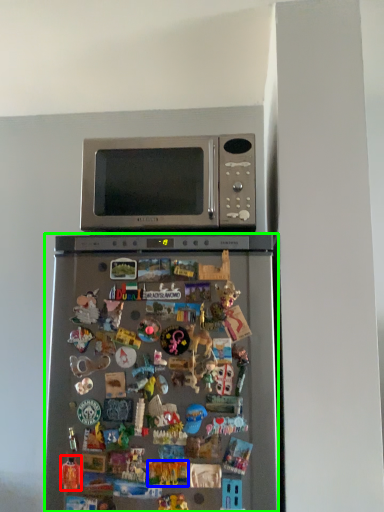
Question: Estimate the real-world distances between objects in this image. Which object is farther from toy (highlighted by a red box), toy (highlighted by a blue box) or refrigerator (highlighted by a green box)?

Choices:
 (A) toy
 (B) refrigerator

Answer: (B)